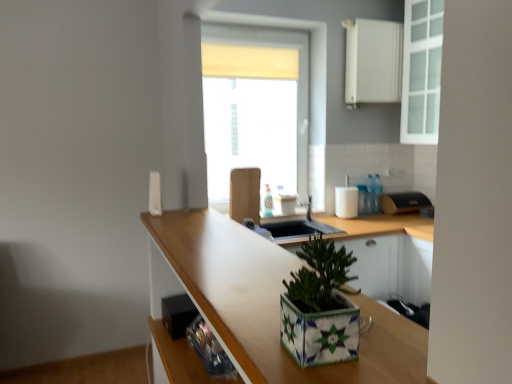
Question: Is white matte radiator at upper right, which is the 3th appliance from back to front, oriented away from black textured bread bin at right, positioned as the 1th appliance in right-to-left order?

Choices:
 (A) yes
 (B) no

Answer: (B)

Question: Considering the relative sizes of white matte radiator at upper right, the fifth appliance ordered from the bottom, and black textured bread bin at right, which appears as the 5th appliance when viewed from the left, in the image provided, is white matte radiator at upper right, the fifth appliance ordered from the bottom, wider than black textured bread bin at right, which appears as the 5th appliance when viewed from the left,?

Choices:
 (A) yes
 (B) no

Answer: (B)

Question: Considering the relative sizes of white matte radiator at upper right, the second appliance positioned from the right, and black textured bread bin at right, positioned as the 1th appliance in right-to-left order, in the image provided, is white matte radiator at upper right, the second appliance positioned from the right, smaller than black textured bread bin at right, positioned as the 1th appliance in right-to-left order,?

Choices:
 (A) yes
 (B) no

Answer: (B)

Question: Does white matte radiator at upper right, which is counted as the first appliance, starting from the top, appear on the left side of black textured bread bin at right, which ranks as the 5th appliance in front-to-back order?

Choices:
 (A) yes
 (B) no

Answer: (A)

Question: Could you tell me if white matte radiator at upper right, which is counted as the first appliance, starting from the top, is turned towards black textured bread bin at right, which appears as the 5th appliance when viewed from the left?

Choices:
 (A) no
 (B) yes

Answer: (A)

Question: Looking at their shapes, would you say white glass cabinet at upper right is wider or thinner than white matte soap dispenser at upper right, marked as the 4th appliance in a front-to-back arrangement?

Choices:
 (A) thin
 (B) wide

Answer: (B)

Question: From a real-world perspective, is white glass cabinet at upper right positioned above or below white matte soap dispenser at upper right, the 2th appliance positioned from the back?

Choices:
 (A) above
 (B) below

Answer: (A)

Question: From the image's perspective, is white glass cabinet at upper right positioned above or below white matte soap dispenser at upper right, the 3th appliance from the top?

Choices:
 (A) below
 (B) above

Answer: (B)

Question: Is white glass cabinet at upper right taller or shorter than white matte soap dispenser at upper right, marked as the 3th appliance in a right-to-left arrangement?

Choices:
 (A) short
 (B) tall

Answer: (B)

Question: From a real-world perspective, relative to white matte radiator at upper right, which is counted as the first appliance, starting from the top, is black plastic speaker at lower left, which is the first appliance in bottom-to-top order, vertically above or below?

Choices:
 (A) above
 (B) below

Answer: (B)

Question: Is black plastic speaker at lower left, positioned as the second appliance in left-to-right order, in front of or behind white matte radiator at upper right, which is the 3th appliance from back to front, in the image?

Choices:
 (A) behind
 (B) front

Answer: (B)

Question: Considering the positions of point (187, 302) and point (358, 91), is point (187, 302) closer or farther from the camera than point (358, 91)?

Choices:
 (A) farther
 (B) closer

Answer: (B)

Question: In terms of height, does black plastic speaker at lower left, which is counted as the fourth appliance, starting from the right, look taller or shorter compared to white matte radiator at upper right, which appears as the 4th appliance when viewed from the left?

Choices:
 (A) tall
 (B) short

Answer: (B)

Question: Is point (176, 302) positioned closer to the camera than point (151, 193)?

Choices:
 (A) farther
 (B) closer

Answer: (B)

Question: Considering the positions of black plastic speaker at lower left, which is the first appliance in bottom-to-top order, and white plastic remote at upper center, positioned as the 1th appliance in left-to-right order, in the image, is black plastic speaker at lower left, which is the first appliance in bottom-to-top order, bigger or smaller than white plastic remote at upper center, positioned as the 1th appliance in left-to-right order,?

Choices:
 (A) big
 (B) small

Answer: (A)